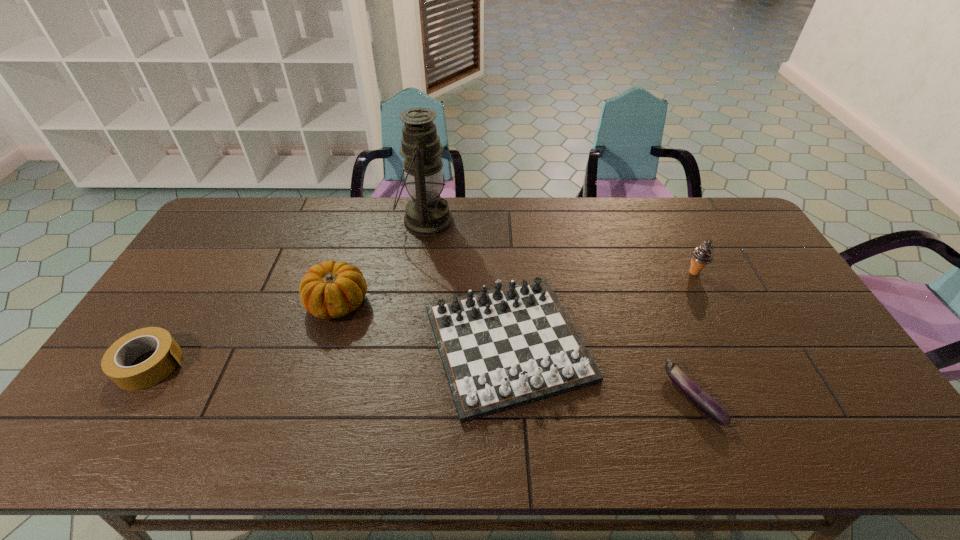
You are a GUI agent. You are given a task and a screenshot of the screen. Output one action in this format:
    pyautogui.click(x=<x>, y=<y>)
    Task: Click on the free region that satisfies the following two spatial constraints: 1. at the edge of the shortest object; 2. on the right side of the duct tape
    
    Given the screenshot: What is the action you would take?
    pyautogui.click(x=132, y=396)

Locate an element on the screen. The width and height of the screenshot is (960, 540). free spot that satisfies the following two spatial constraints: 1. on the front side of the chessboard; 2. on the right side of the eggplant is located at coordinates (511, 396).

The width and height of the screenshot is (960, 540). In order to click on free region that satisfies the following two spatial constraints: 1. at the edge of the second object from right to left; 2. on the right side of the second shortest object in this screenshot , I will do `click(132, 396)`.

Identify the location of vacant space that satisfies the following two spatial constraints: 1. at the edge of the fifth object from left to right; 2. on the right side of the fifth tallest object. (132, 396).

Identify the location of blank space that satisfies the following two spatial constraints: 1. on the back side of the fifth nearest object; 2. on the left side of the fifth object from right to left. (348, 272).

Where is `free space in the image that satisfies the following two spatial constraints: 1. on the front side of the fourth tallest object; 2. on the left side of the eggplant`? This screenshot has width=960, height=540. free space in the image that satisfies the following two spatial constraints: 1. on the front side of the fourth tallest object; 2. on the left side of the eggplant is located at coordinates (511, 396).